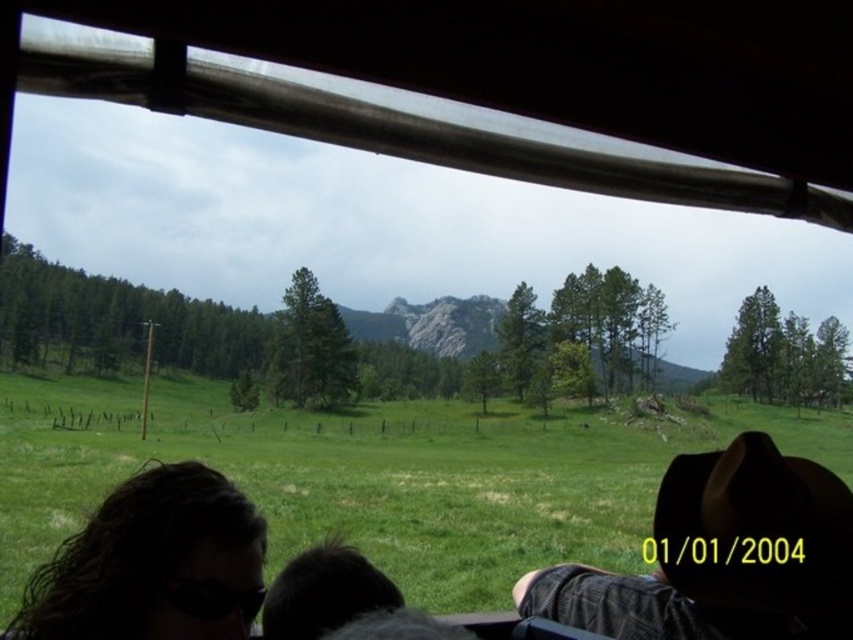
Question: Can you confirm if brown felt hat at lower right is positioned to the left of dark hair at lower left?

Choices:
 (A) yes
 (B) no

Answer: (B)

Question: Can you confirm if brown felt hat at lower right is thinner than dark hair at lower left?

Choices:
 (A) yes
 (B) no

Answer: (A)

Question: Can you confirm if dark hair at lower left is positioned below black fur at lower center?

Choices:
 (A) no
 (B) yes

Answer: (B)

Question: Which object is positioned closest to the dark hair at lower left?

Choices:
 (A) brown felt hat at lower right
 (B) black fur at lower center

Answer: (B)

Question: Considering the real-world distances, which object is closest to the dark hair at lower left?

Choices:
 (A) brown felt hat at lower right
 (B) black fur at lower center

Answer: (B)

Question: Which point appears farthest from the camera in this image?

Choices:
 (A) (314, 552)
 (B) (160, 490)

Answer: (A)